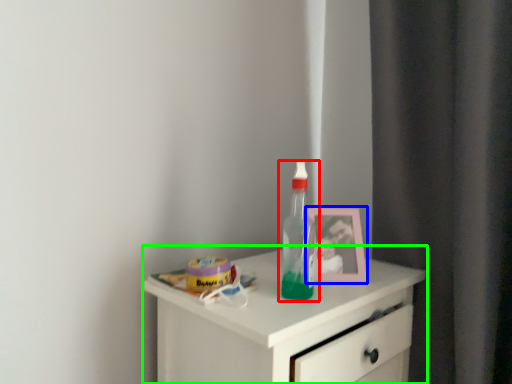
Question: Based on their relative distances, which object is nearer to bottle (highlighted by a red box)? Choose from picture frame (highlighted by a blue box) and chest of drawers (highlighted by a green box).

Choices:
 (A) picture frame
 (B) chest of drawers

Answer: (A)